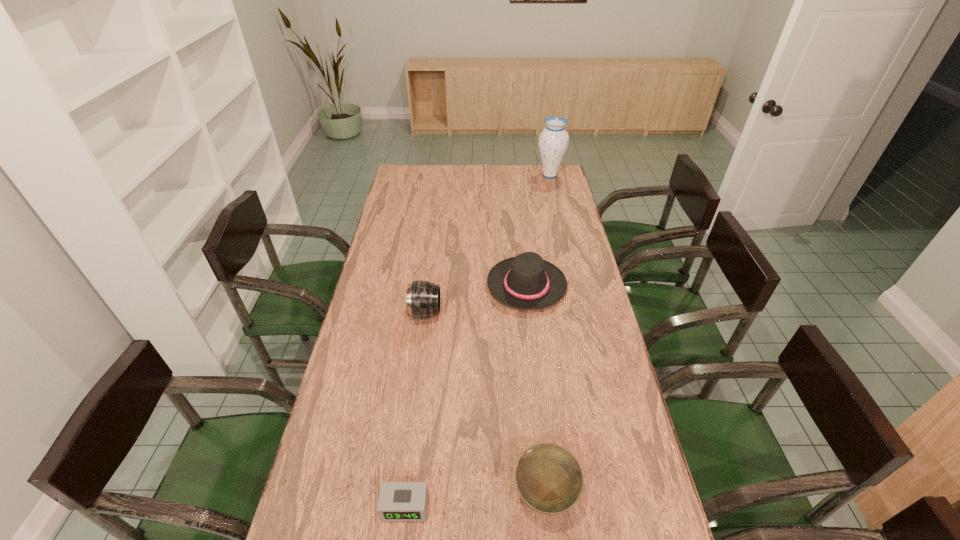
What are the coordinates of `object at the far edge` in the screenshot? It's located at (553, 141).

Find the location of a particular element. This screenshot has height=540, width=960. vase that is positioned at the right edge is located at coordinates (553, 141).

Image resolution: width=960 pixels, height=540 pixels. In order to click on dress hat located at the right edge in this screenshot , I will do `click(527, 282)`.

Locate an element on the screen. Image resolution: width=960 pixels, height=540 pixels. object positioned at the far right corner is located at coordinates (553, 141).

The image size is (960, 540). What are the coordinates of `free point at the far edge` in the screenshot? It's located at (455, 181).

The image size is (960, 540). In order to click on vacant region at the left edge of the desktop in this screenshot , I will do `click(349, 517)`.

Image resolution: width=960 pixels, height=540 pixels. Identify the location of free spot at the right edge of the desktop. (613, 400).

Where is `vacant region at the far left corner of the desktop`? vacant region at the far left corner of the desktop is located at coordinates (416, 172).

This screenshot has height=540, width=960. What are the coordinates of `free space that is in between the second tallest object and the bowl` in the screenshot? It's located at (485, 404).

You are a GUI agent. You are given a task and a screenshot of the screen. Output one action in this format:
    pyautogui.click(x=<x>, y=<y>)
    Task: Click on the free space between the second tallest object and the dress hat
    
    Given the screenshot: What is the action you would take?
    pyautogui.click(x=476, y=300)